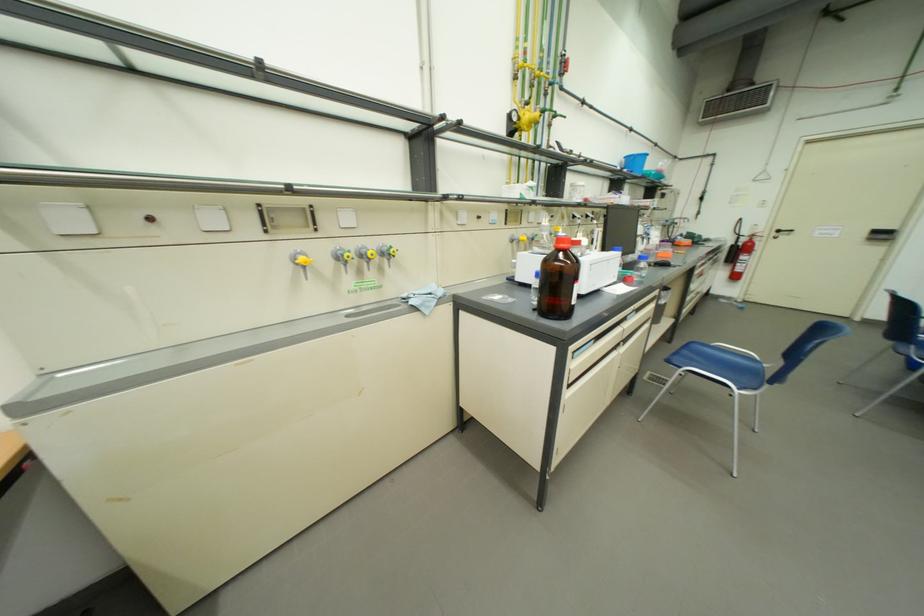
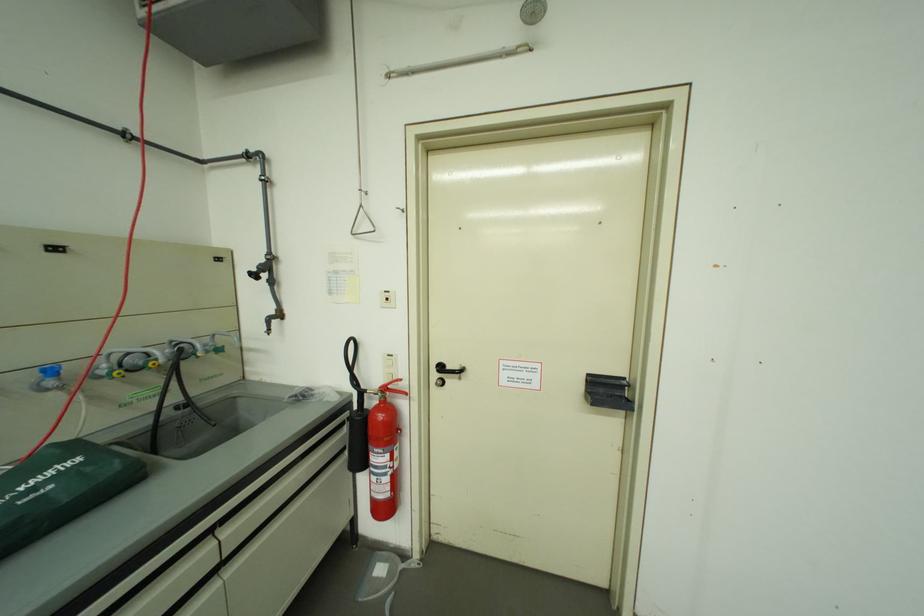
Locate, in the second image, the point that corresponds to point (787, 233) in the first image.

(451, 369)